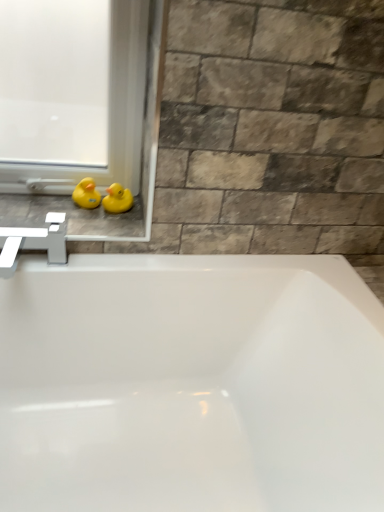
Question: Is the position of yellow rubber duck at left, which is the 2th duck in right-to-left order, less distant than that of yellow rubber duck at left?

Choices:
 (A) no
 (B) yes

Answer: (A)

Question: Is yellow rubber duck at left, the 1th duck when ordered from left to right, positioned with its back to yellow rubber duck at left?

Choices:
 (A) yes
 (B) no

Answer: (B)

Question: Is the position of yellow rubber duck at left, which is the 2th duck in right-to-left order, more distant than that of yellow rubber duck at left?

Choices:
 (A) yes
 (B) no

Answer: (A)

Question: Is yellow rubber duck at left, which is the 2th duck in right-to-left order, facing towards yellow rubber duck at left?

Choices:
 (A) no
 (B) yes

Answer: (B)

Question: Considering the relative sizes of yellow rubber duck at left, which is the 2th duck in right-to-left order, and yellow rubber duck at left in the image provided, is yellow rubber duck at left, which is the 2th duck in right-to-left order, thinner than yellow rubber duck at left?

Choices:
 (A) yes
 (B) no

Answer: (A)

Question: From the image's perspective, is yellow rubber duck at left, which is the 2th duck in right-to-left order, positioned above or below yellow rubber duck at upper left, the first duck positioned from the right?

Choices:
 (A) below
 (B) above

Answer: (B)

Question: In terms of height, does yellow rubber duck at left, which is the 2th duck in right-to-left order, look taller or shorter compared to yellow rubber duck at upper left, the 2th duck in the left-to-right sequence?

Choices:
 (A) tall
 (B) short

Answer: (A)

Question: Is yellow rubber duck at left, the 1th duck when ordered from left to right, in front of or behind yellow rubber duck at upper left, the first duck positioned from the right, in the image?

Choices:
 (A) behind
 (B) front

Answer: (A)

Question: Is yellow rubber duck at left, the 1th duck when ordered from left to right, wider or thinner than yellow rubber duck at upper left, the 2th duck in the left-to-right sequence?

Choices:
 (A) wide
 (B) thin

Answer: (A)

Question: Based on their sizes in the image, would you say yellow rubber duck at left is bigger or smaller than yellow rubber duck at upper left, the first duck positioned from the right?

Choices:
 (A) small
 (B) big

Answer: (B)

Question: Considering their positions, is yellow rubber duck at left located in front of or behind yellow rubber duck at upper left, the first duck positioned from the right?

Choices:
 (A) front
 (B) behind

Answer: (A)

Question: Does point (11, 201) appear closer or farther from the camera than point (110, 203)?

Choices:
 (A) farther
 (B) closer

Answer: (A)

Question: Is yellow rubber duck at left inside the boundaries of yellow rubber duck at upper left, the first duck positioned from the right, or outside?

Choices:
 (A) outside
 (B) inside

Answer: (A)

Question: From the image's perspective, is yellow rubber duck at left, which is the 2th duck in right-to-left order, above or below white plastic window frame at lower left?

Choices:
 (A) below
 (B) above

Answer: (A)

Question: Is yellow rubber duck at left, which is the 2th duck in right-to-left order, in front of or behind white plastic window frame at lower left in the image?

Choices:
 (A) front
 (B) behind

Answer: (B)